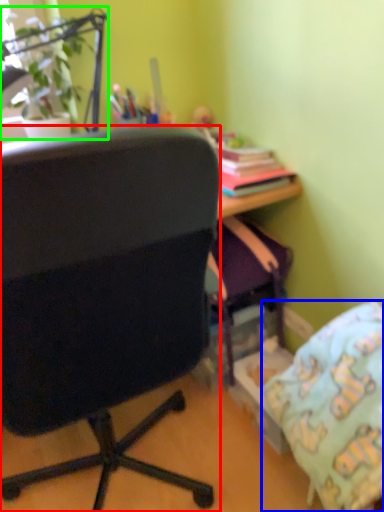
Question: Considering the real-world distances, which object is farthest from chair (highlighted by a red box)? pillow (highlighted by a blue box) or houseplant (highlighted by a green box)?

Choices:
 (A) pillow
 (B) houseplant

Answer: (B)